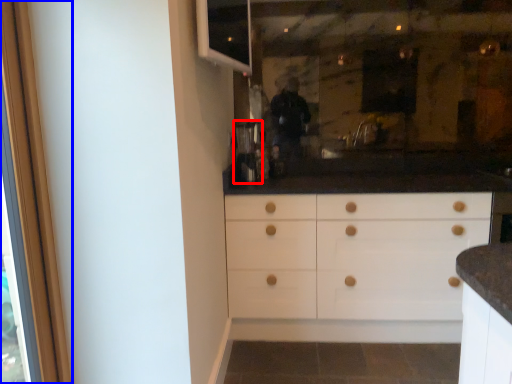
Question: Which object is closer to the camera taking this photo, coffee machine (highlighted by a red box) or screen door (highlighted by a blue box)?

Choices:
 (A) coffee machine
 (B) screen door

Answer: (B)